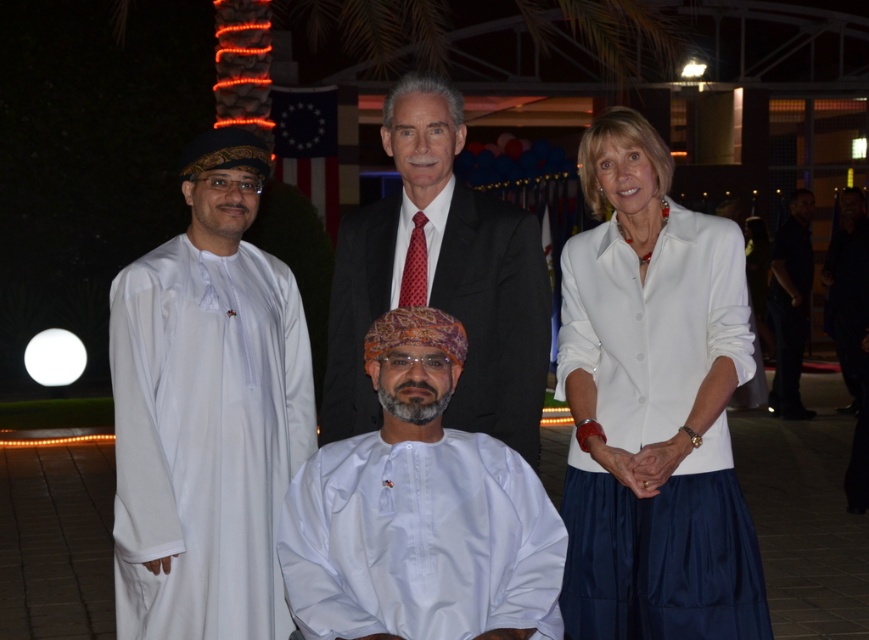
Which is more to the right, matte black suit at center or white satin blouse at upper right?

Positioned to the right is white satin blouse at upper right.

Based on the photo, does matte black suit at center have a greater width compared to white satin blouse at upper right?

No.

The width and height of the screenshot is (869, 640). What do you see at coordinates (440, 278) in the screenshot?
I see `matte black suit at center` at bounding box center [440, 278].

You are a GUI agent. You are given a task and a screenshot of the screen. Output one action in this format:
    pyautogui.click(x=<x>, y=<y>)
    Task: Click on the matte black suit at center
    
    Given the screenshot: What is the action you would take?
    pyautogui.click(x=440, y=278)

Between white satin blouse at center and white cotton robe at left, which one has more height?

white satin blouse at center is taller.

Find the location of `white satin blouse at center`. white satin blouse at center is located at coordinates (653, 406).

Who is more forward, (x=734, y=227) or (x=277, y=620)?

Positioned in front is point (x=734, y=227).

You are a GUI agent. You are given a task and a screenshot of the screen. Output one action in this format:
    pyautogui.click(x=<x>, y=<y>)
    Task: Click on the white satin blouse at center
    The height and width of the screenshot is (640, 869).
    Given the screenshot: What is the action you would take?
    pyautogui.click(x=653, y=406)

Does white satin blouse at center appear on the right side of white satin blouse at upper right?

Yes, white satin blouse at center is to the right of white satin blouse at upper right.

Who is lower down, white satin blouse at center or white satin blouse at upper right?

white satin blouse at upper right is below.

Find the location of a particular element. white satin blouse at center is located at coordinates (653, 406).

Where is `white satin blouse at center`? Image resolution: width=869 pixels, height=640 pixels. white satin blouse at center is located at coordinates (653, 406).